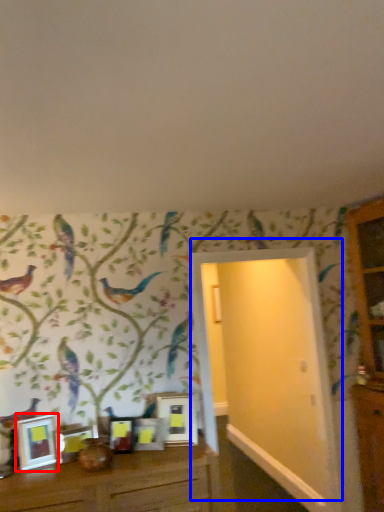
Question: Which point is further to the camera, picture frame (highlighted by a red box) or door (highlighted by a blue box)?

Choices:
 (A) picture frame
 (B) door

Answer: (B)